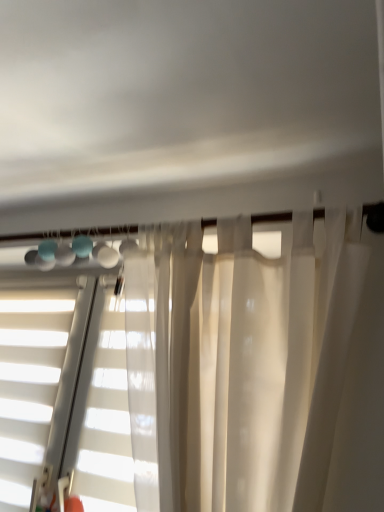
Question: Is translucent white blinds at center positioned far away from white matte blinds at left?

Choices:
 (A) yes
 (B) no

Answer: (B)

Question: Is translucent white blinds at center at the right side of white matte blinds at left?

Choices:
 (A) no
 (B) yes

Answer: (B)

Question: Is translucent white blinds at center not within white matte blinds at left?

Choices:
 (A) yes
 (B) no

Answer: (A)

Question: From a real-world perspective, is translucent white blinds at center beneath white matte blinds at left?

Choices:
 (A) yes
 (B) no

Answer: (B)

Question: Is translucent white blinds at center wider than white matte blinds at left?

Choices:
 (A) yes
 (B) no

Answer: (B)

Question: From the image's perspective, is translucent white blinds at center beneath white matte blinds at left?

Choices:
 (A) no
 (B) yes

Answer: (A)

Question: Considering the relative sizes of white matte blinds at left and translucent white blinds at center in the image provided, is white matte blinds at left thinner than translucent white blinds at center?

Choices:
 (A) no
 (B) yes

Answer: (A)

Question: Would you say white matte blinds at left is a long distance from translucent white blinds at center?

Choices:
 (A) no
 (B) yes

Answer: (A)

Question: Is white matte blinds at left outside translucent white blinds at center?

Choices:
 (A) no
 (B) yes

Answer: (B)

Question: From a real-world perspective, is white matte blinds at left beneath translucent white blinds at center?

Choices:
 (A) no
 (B) yes

Answer: (B)

Question: Can you confirm if white matte blinds at left is positioned to the right of translucent white blinds at center?

Choices:
 (A) yes
 (B) no

Answer: (B)

Question: Would you say translucent white blinds at center is part of white matte blinds at left's contents?

Choices:
 (A) no
 (B) yes

Answer: (A)

Question: In the image, is white matte blinds at left on the left side or the right side of translucent white blinds at center?

Choices:
 (A) left
 (B) right

Answer: (A)